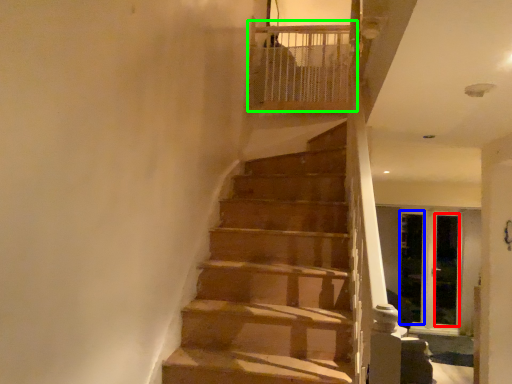
Question: Which object is positioned closest to screen door (highlighted by a red box)? Select from screen door (highlighted by a blue box) and balustrade (highlighted by a green box).

Choices:
 (A) screen door
 (B) balustrade

Answer: (A)